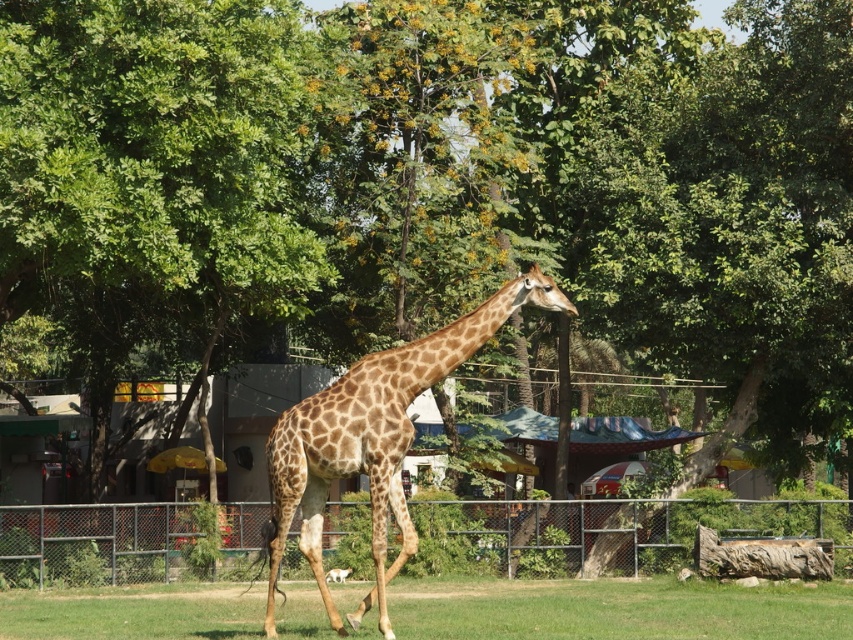
Question: Does metallic silver fence at lower center come behind spotted fur giraffe at center?

Choices:
 (A) no
 (B) yes

Answer: (B)

Question: Which object appears closest to the camera in this image?

Choices:
 (A) metallic silver fence at lower center
 (B) green leafy tree at center
 (C) spotted fur giraffe at center
 (D) green grass at lower center

Answer: (C)

Question: Does metallic silver fence at lower center appear over spotted fur giraffe at center?

Choices:
 (A) no
 (B) yes

Answer: (A)

Question: Which object appears farthest from the camera in this image?

Choices:
 (A) spotted fur giraffe at center
 (B) green leafy tree at center
 (C) green grass at lower center
 (D) metallic silver fence at lower center

Answer: (D)

Question: Which of the following is the closest to the observer?

Choices:
 (A) (28, 548)
 (B) (294, 10)
 (C) (409, 378)

Answer: (C)

Question: Can you confirm if green leafy tree at center is bigger than metallic silver fence at lower center?

Choices:
 (A) yes
 (B) no

Answer: (A)